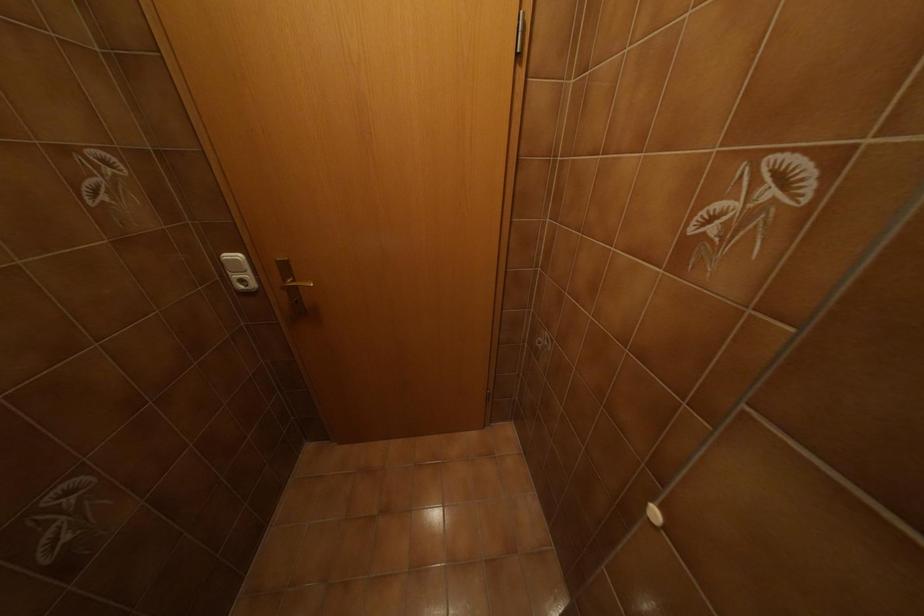
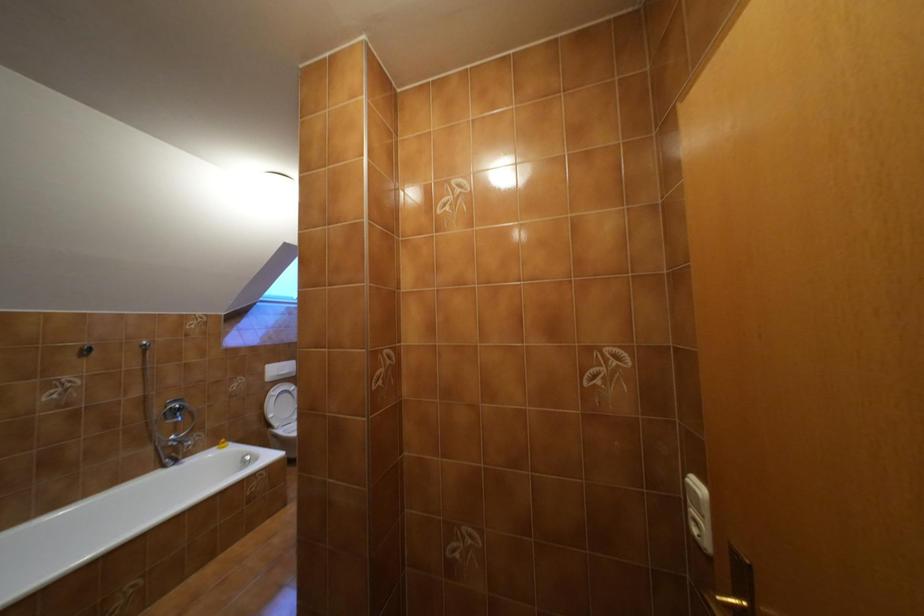
Question: The camera is either moving clockwise (left) or counter-clockwise (right) around the object. The first image is from the beginning of the video and the second image is from the end. Is the camera moving left or right when shooting the video?

Choices:
 (A) Left
 (B) Right

Answer: (B)